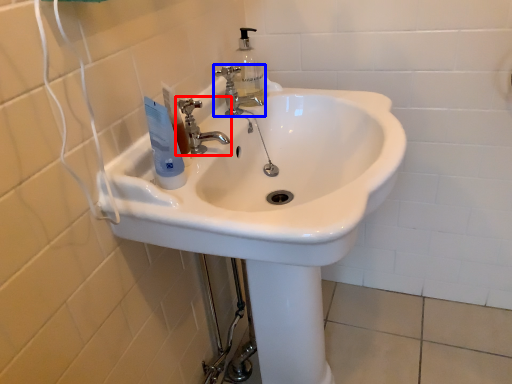
Question: Which of the following is the closest to the observer, tap (highlighted by a red box) or tap (highlighted by a blue box)?

Choices:
 (A) tap
 (B) tap

Answer: (A)